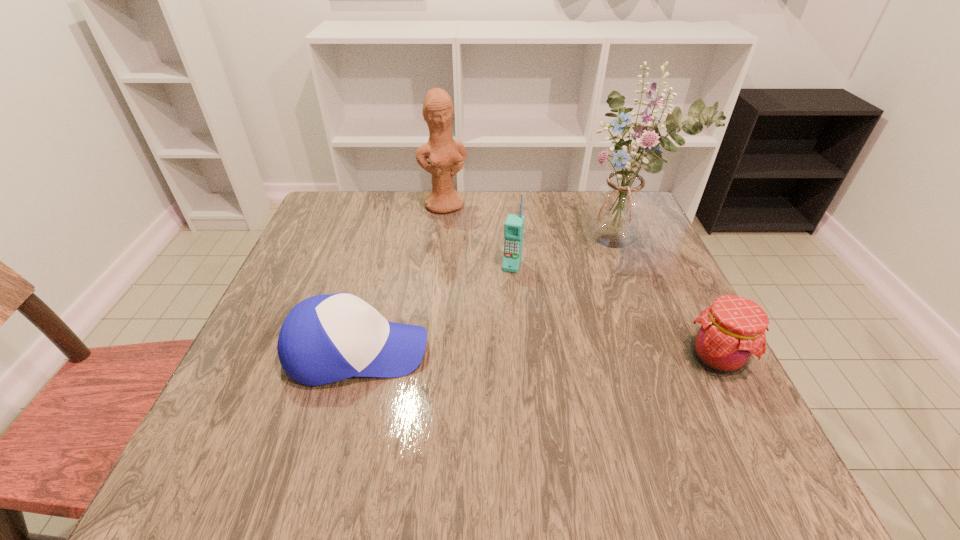
Find the location of a particular element. vacant space positioned 0.370m on the front-facing side of the bouquet is located at coordinates (499, 355).

Where is `vacant area situated 0.310m on the front-facing side of the fourth shortest object`? vacant area situated 0.310m on the front-facing side of the fourth shortest object is located at coordinates (480, 288).

You are a GUI agent. You are given a task and a screenshot of the screen. Output one action in this format:
    pyautogui.click(x=<x>, y=<y>)
    Task: Click on the vacant space located 0.220m on the front-facing side of the fourth shortest object
    The height and width of the screenshot is (540, 960).
    Given the screenshot: What is the action you would take?
    pyautogui.click(x=470, y=264)

The width and height of the screenshot is (960, 540). Find the location of `blank area located on the front-facing side of the fourth shortest object`. blank area located on the front-facing side of the fourth shortest object is located at coordinates (482, 291).

Locate an element on the screen. vacant region located on the keypad of the third object from left to right is located at coordinates (494, 321).

This screenshot has height=540, width=960. In order to click on vacant space situated on the keypad of the third object from left to right in this screenshot , I will do tap(490, 335).

Locate an element on the screen. Image resolution: width=960 pixels, height=540 pixels. free spot located 0.160m on the keypad of the third object from left to right is located at coordinates (494, 321).

Find the location of `bouquet present at the far edge`. bouquet present at the far edge is located at coordinates (619, 208).

In order to click on figurine at the far edge in this screenshot , I will do (x=446, y=156).

You are a GUI agent. You are given a task and a screenshot of the screen. Output one action in this format:
    pyautogui.click(x=<x>, y=<y>)
    Task: Click on the object at the near edge
    This screenshot has height=540, width=960.
    Given the screenshot: What is the action you would take?
    pyautogui.click(x=327, y=338)